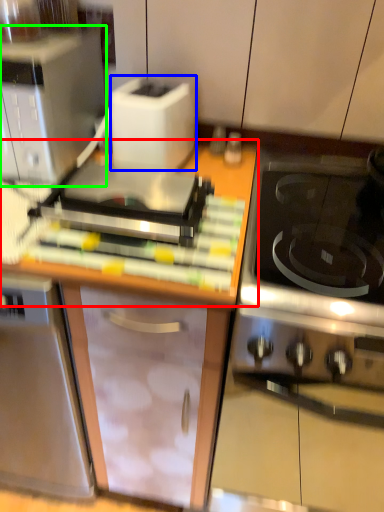
Question: Which object is positioned closest to countertop (highlighted by a red box)? Select from toaster (highlighted by a blue box) and kitchen appliance (highlighted by a green box).

Choices:
 (A) toaster
 (B) kitchen appliance

Answer: (A)